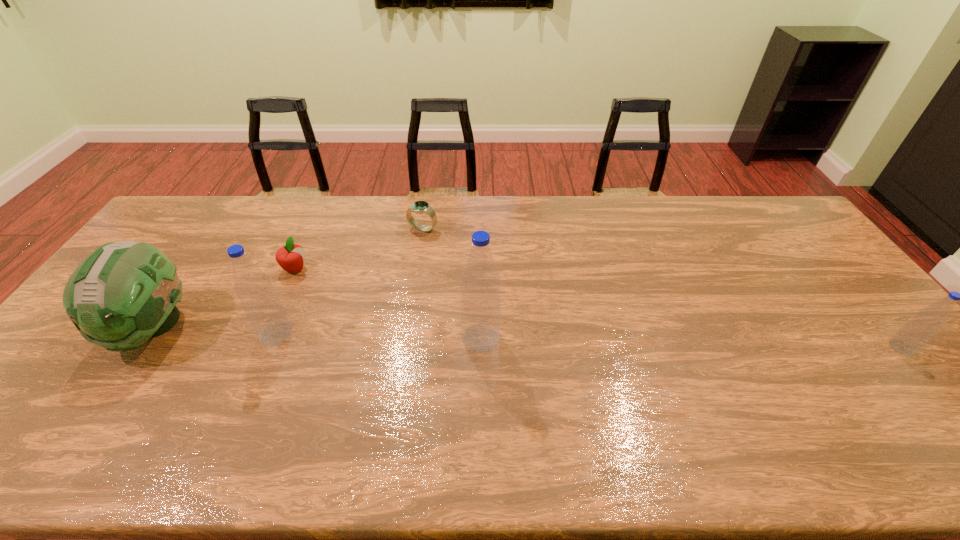
Please mark a free spot for a new water_bottle to balance the arrangement. Please provide its 2D coordinates. Your answer should be formatted as a tuple, i.e. [(x, y)], where the tuple contains the x and y coordinates of a point satisfying the conditions above.

[(689, 342)]